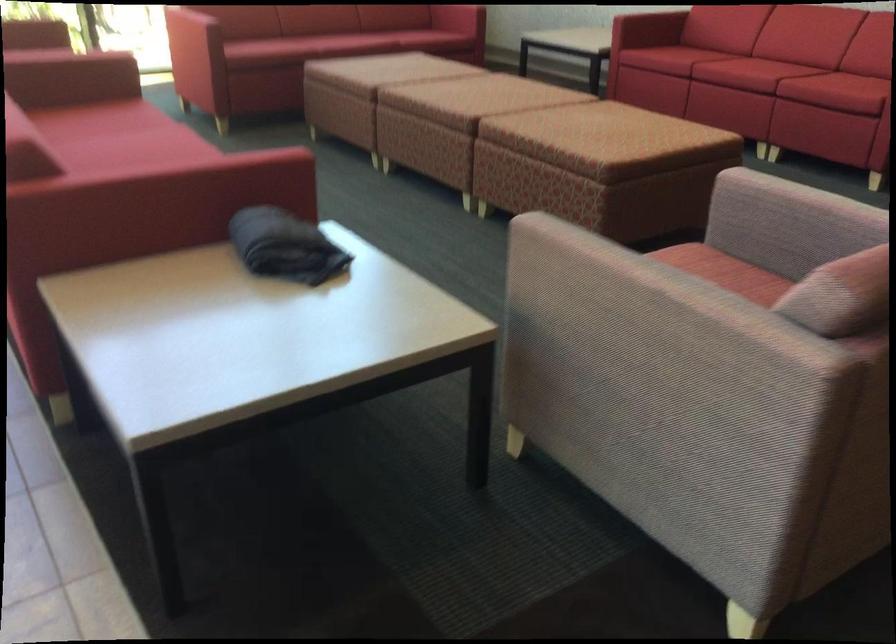
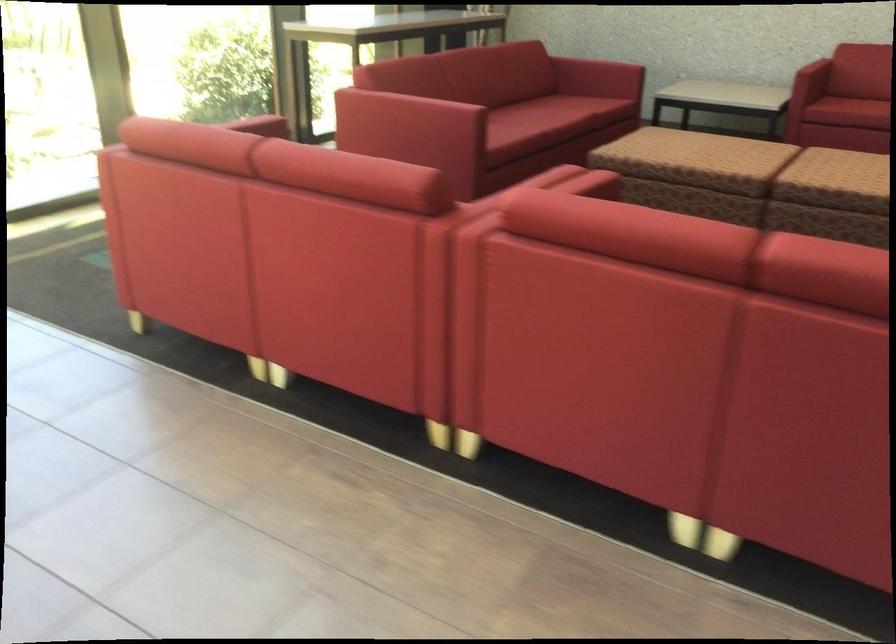
Question: The images are taken continuously from a first-person perspective. In which direction are you moving?

Choices:
 (A) Left
 (B) Right
 (C) Forward
 (D) Backward

Answer: (D)